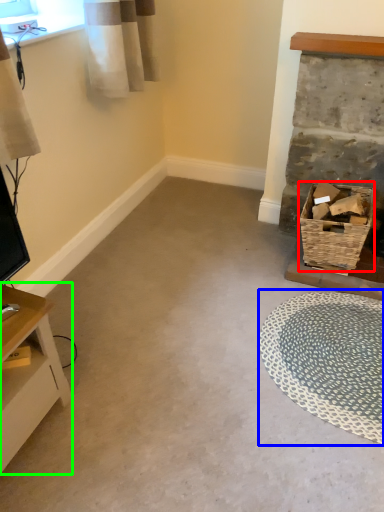
Question: Which object is positioned closest to basket (highlighted by a red box)? Select from mat (highlighted by a blue box) and table (highlighted by a green box).

Choices:
 (A) mat
 (B) table

Answer: (A)